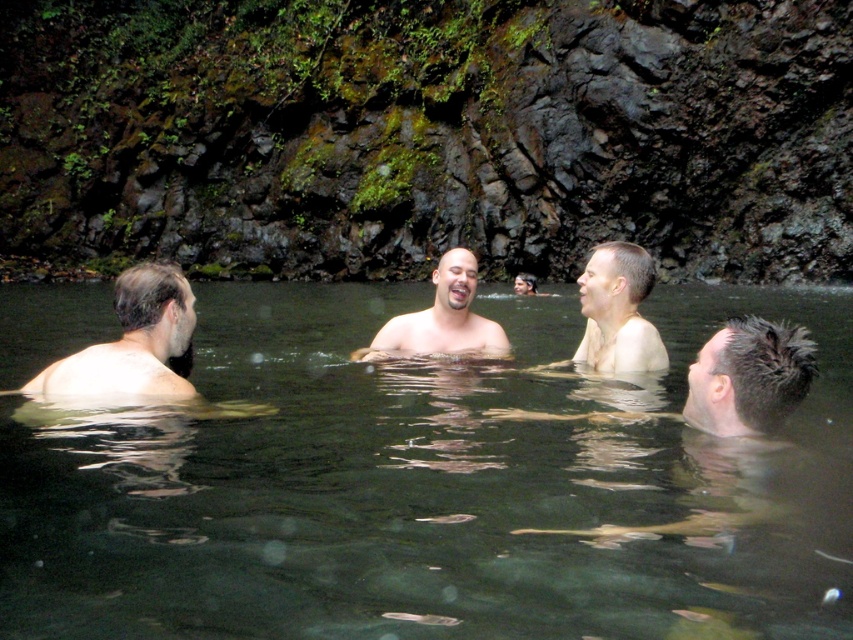
Between light brown skin at center and smooth skin man at center, which one appears on the left side from the viewer's perspective?

Positioned to the left is smooth skin man at center.

Looking at this image, does light brown skin at center have a lesser width compared to smooth skin man at center?

Yes.

Where is `light brown skin at center`? This screenshot has width=853, height=640. light brown skin at center is located at coordinates (618, 310).

Identify the location of light brown skin at center. Image resolution: width=853 pixels, height=640 pixels. (618, 310).

Who is lower down, light brown skin at left or smooth skin man at center?

light brown skin at left is lower down.

Is the position of light brown skin at left less distant than that of smooth skin man at center?

Yes, it is.

You are a GUI agent. You are given a task and a screenshot of the screen. Output one action in this format:
    pyautogui.click(x=<x>, y=<y>)
    Task: Click on the light brown skin at left
    Image resolution: width=853 pixels, height=640 pixels.
    Given the screenshot: What is the action you would take?
    pyautogui.click(x=134, y=340)

Locate an element on the screen. The height and width of the screenshot is (640, 853). light brown skin at left is located at coordinates (134, 340).

Based on the photo, does transparent water at center have a lesser height compared to light brown skin at center?

In fact, transparent water at center may be taller than light brown skin at center.

Consider the image. Between transparent water at center and light brown skin at center, which one appears on the left side from the viewer's perspective?

transparent water at center is more to the left.

Is point (24, 342) positioned in front of point (614, 285)?

No, (24, 342) is behind (614, 285).

Identify the location of transparent water at center. (433, 486).